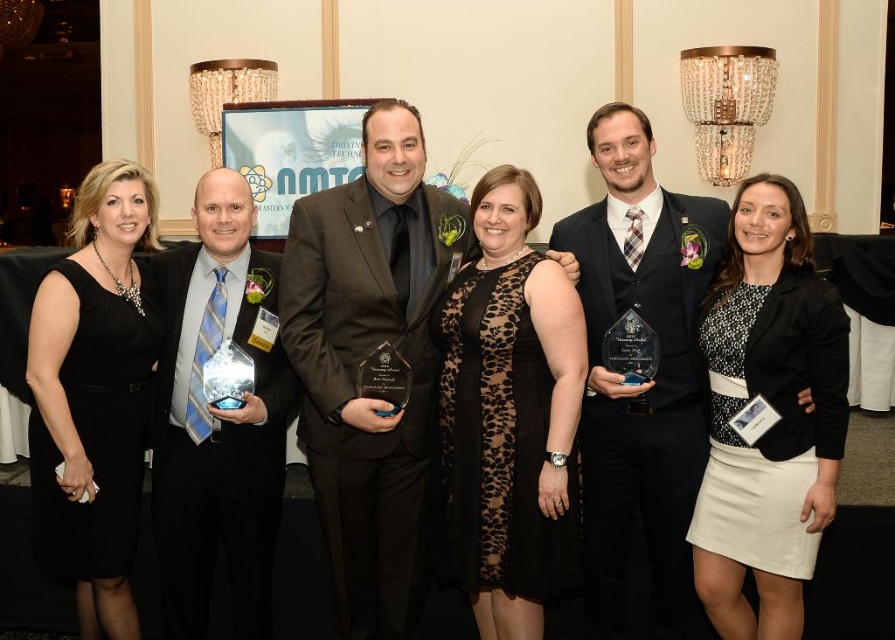
Question: Which point is farther to the camera?

Choices:
 (A) (126, 529)
 (B) (533, 397)
 (C) (697, 196)
 (D) (783, 324)

Answer: (C)

Question: Which object is farther from the camera taking this photo?

Choices:
 (A) black dress at left
 (B) shiny dark blue suit at center
 (C) matte black suit at center
 (D) shiny silver award at center

Answer: (B)

Question: Is black lace dress at center thinner than black textured dress at center?

Choices:
 (A) yes
 (B) no

Answer: (B)

Question: Does matte black suit at center appear on the left side of shiny silver award at center?

Choices:
 (A) yes
 (B) no

Answer: (B)

Question: Is black lace dress at center thinner than black dress at left?

Choices:
 (A) no
 (B) yes

Answer: (A)

Question: Which point appears farthest from the camera in this image?

Choices:
 (A) (364, 545)
 (B) (229, 490)
 (C) (555, 547)
 (D) (788, 403)

Answer: (B)